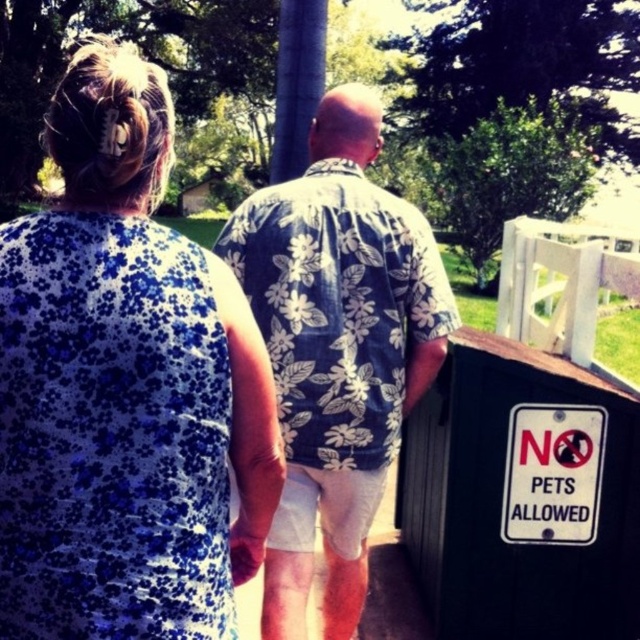
You are a fashion designer observing two people walking away from you. You notice the blue floral dress at upper left and the floral fabric shirt at center. Which clothing item has a shorter length?

The blue floral dress at upper left is shorter than the floral fabric shirt at center.

You are a photographer trying to capture both the blue floral dress at upper left and the floral fabric shirt at center in a single frame. Which of the two clothing items appears narrower in the image?

The blue floral dress at upper left appears narrower than the floral fabric shirt at center in the image.